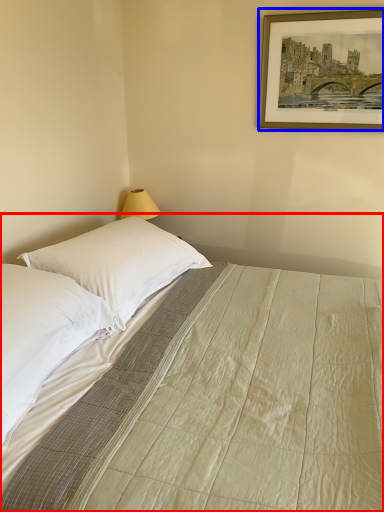
Question: Which object appears closest to the camera in this image, bed (highlighted by a red box) or picture frame (highlighted by a blue box)?

Choices:
 (A) bed
 (B) picture frame

Answer: (A)